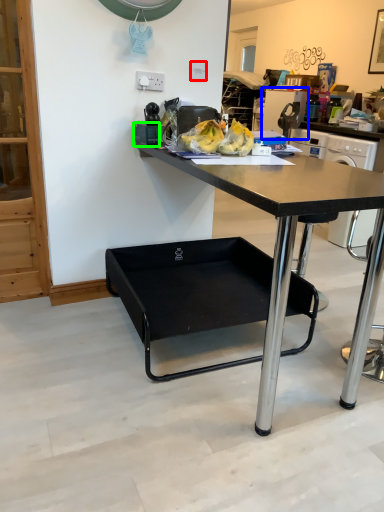
Question: Considering the real-world distances, which object is farthest from power outlet (highlighted by a red box)? appliance (highlighted by a blue box) or tableware (highlighted by a green box)?

Choices:
 (A) appliance
 (B) tableware

Answer: (A)